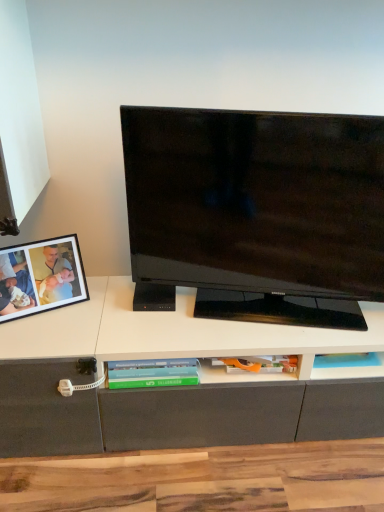
Question: From a real-world perspective, is black glossy television at center physically located above or below green matte book at center?

Choices:
 (A) below
 (B) above

Answer: (B)

Question: From the image's perspective, is black glossy television at center above or below green matte book at center?

Choices:
 (A) below
 (B) above

Answer: (B)

Question: Estimate the real-world distances between objects in this image. Which object is farther from the matte black picture frame at left?

Choices:
 (A) green matte book at center
 (B) black glossy television at center

Answer: (B)

Question: Considering the real-world distances, which object is farthest from the black glossy television at center?

Choices:
 (A) matte black picture frame at left
 (B) green matte book at center

Answer: (A)